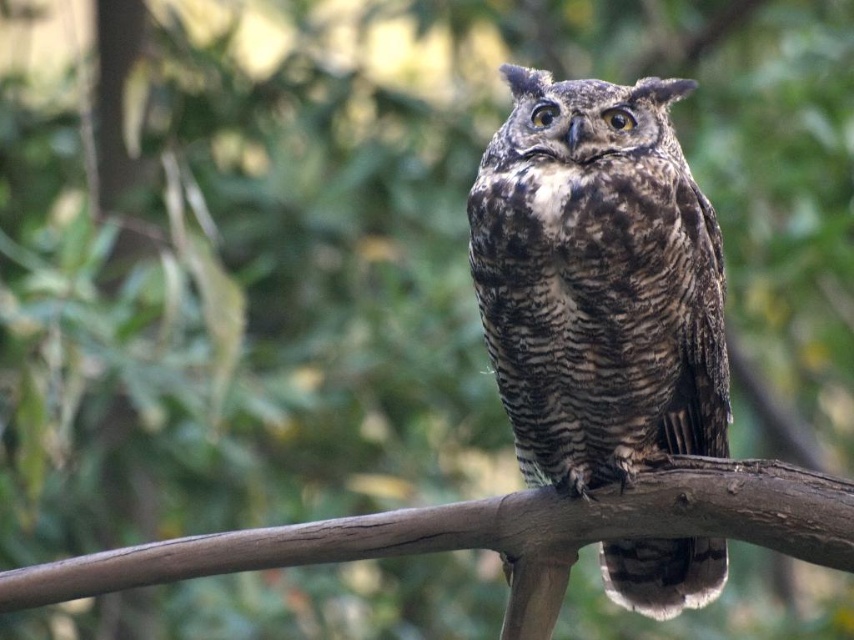
Question: Can you confirm if brown speckled owl at center is positioned to the right of brown wood at center?

Choices:
 (A) yes
 (B) no

Answer: (A)

Question: Where is brown speckled owl at center located in relation to brown wood at center in the image?

Choices:
 (A) above
 (B) below

Answer: (A)

Question: Does brown speckled owl at center appear over brown wood at center?

Choices:
 (A) no
 (B) yes

Answer: (B)

Question: Which point is closer to the camera?

Choices:
 (A) (610, 100)
 (B) (525, 595)

Answer: (B)